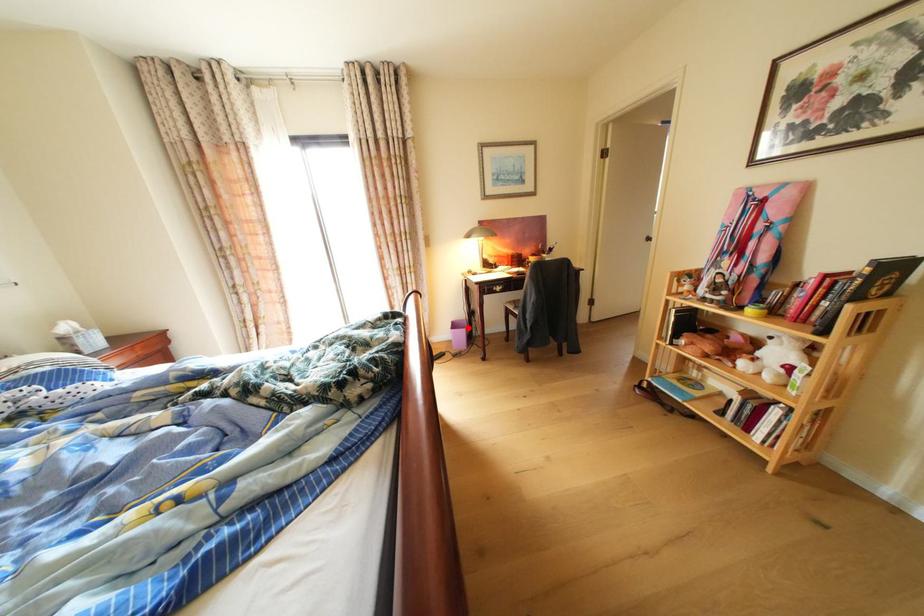
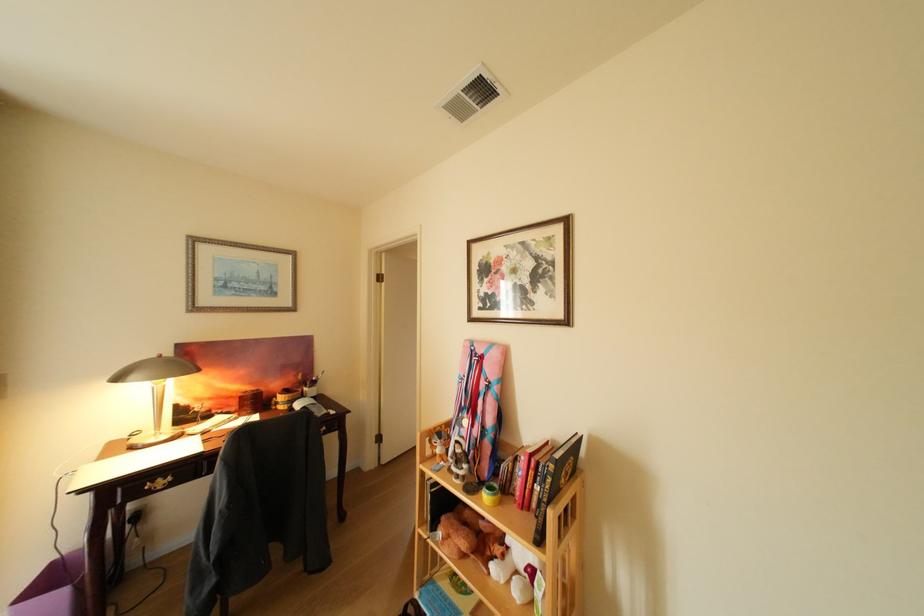
Question: I am providing you with two images of the same scene from different viewpoints. Image1 has a red point marked. In image2, the corresponding 3D location appears at what relative position? Reply with the corresponding letter.

Choices:
 (A) Closer
 (B) Farther

Answer: (A)